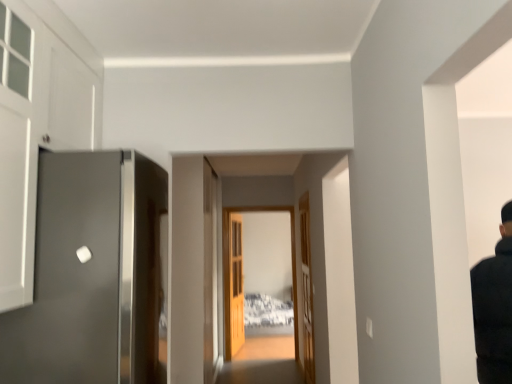
Question: Choose the correct answer: Is clear glass door at center inside wooden door at center, which appears as the 1th door when viewed from the right, or outside it?

Choices:
 (A) inside
 (B) outside

Answer: (B)

Question: Considering the positions of clear glass door at center and wooden door at center, the 2th door positioned from the front, in the image, is clear glass door at center taller or shorter than wooden door at center, the 2th door positioned from the front,?

Choices:
 (A) short
 (B) tall

Answer: (B)

Question: Estimate the real-world distances between objects in this image. Which object is farther from the satin gray door at left, acting as the third door starting from the back?

Choices:
 (A) wooden door at center, acting as the third door starting from the left
 (B) clear glass door at center
 (C) wooden door at center, positioned as the 1th door in back-to-front order

Answer: (C)

Question: Which object is the farthest from the wooden door at center, the 2th door positioned from the front?

Choices:
 (A) wooden door at center, positioned as the 1th door in back-to-front order
 (B) satin gray door at left, the first door in the left-to-right sequence
 (C) clear glass door at center

Answer: (B)